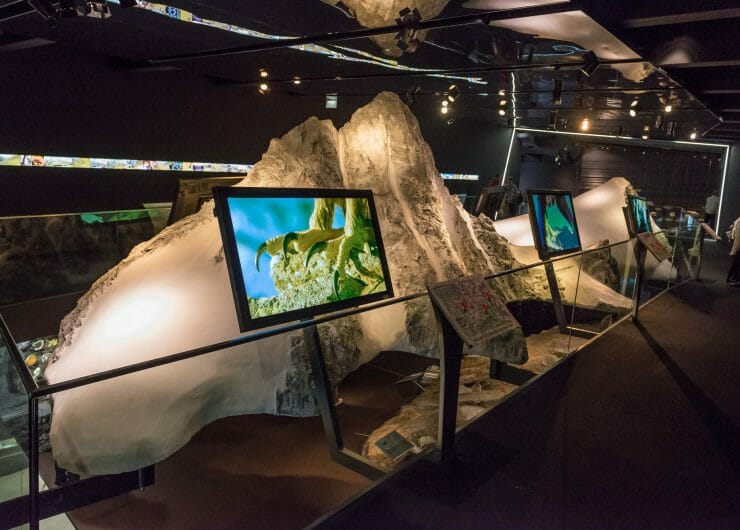
Find the location of a particular element. This screenshot has width=740, height=530. glass is located at coordinates (38, 259), (673, 176).